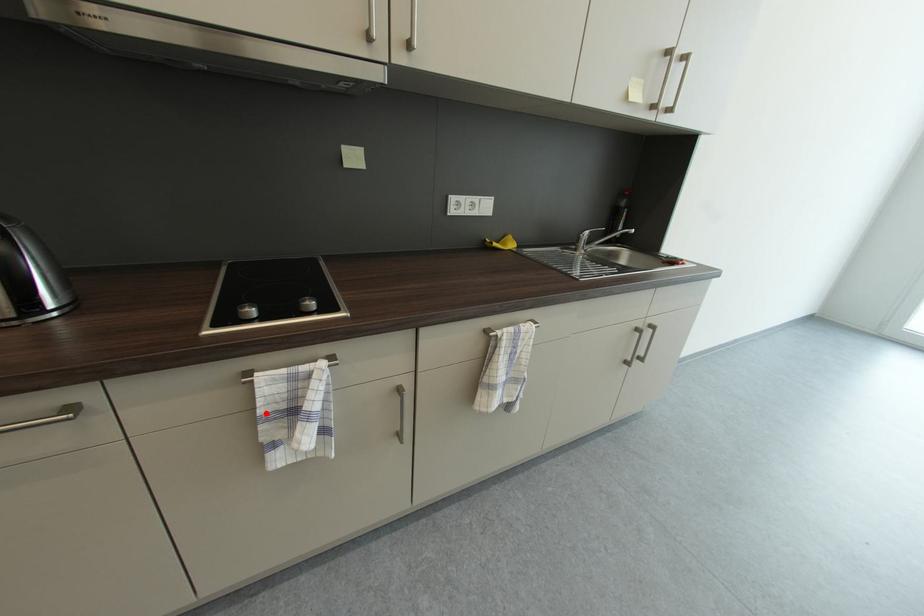
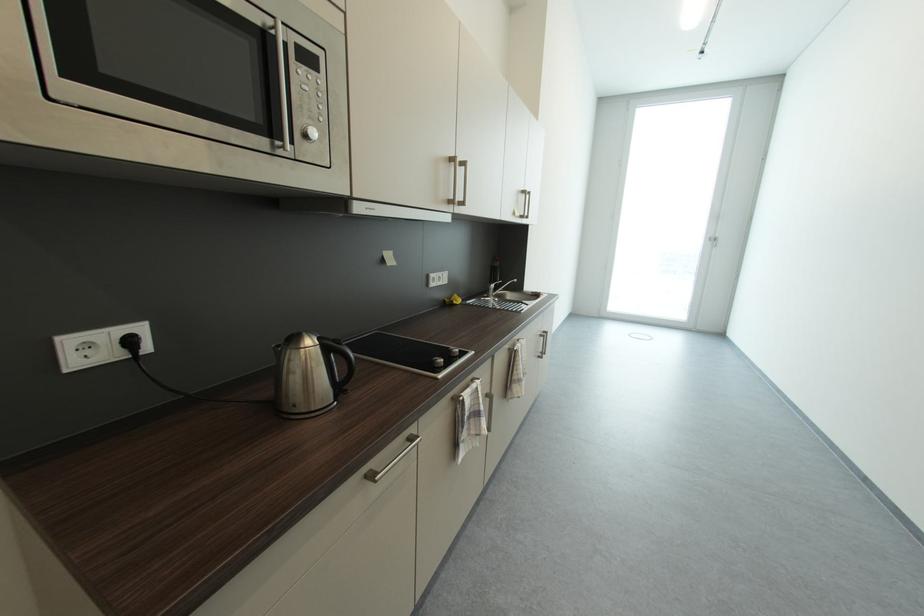
The point at the highlighted location is marked in the first image. Where is the corresponding point in the second image?

(472, 419)